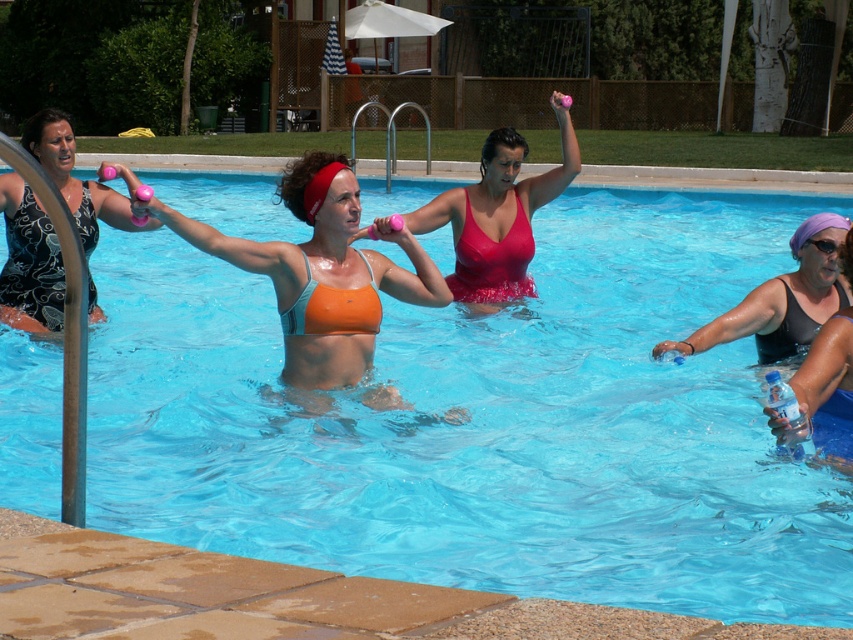
You are a lifeguard observing the pool area. You notice two women in the water, one wearing a matte orange swimsuit at center and the other in a matte black swimsuit at left. Which swimmer appears narrower in the water?

The matte orange swimsuit at center appears narrower compared to the matte black swimsuit at left because it has a lesser width.

You are a lifeguard observing the water aerobics class. Which swimmer is positioned higher between the matte orange swimsuit at center and the orange bikini at upper center?

The matte orange swimsuit at center is above the orange bikini at upper center, so the matte orange swimsuit at center is positioned higher.